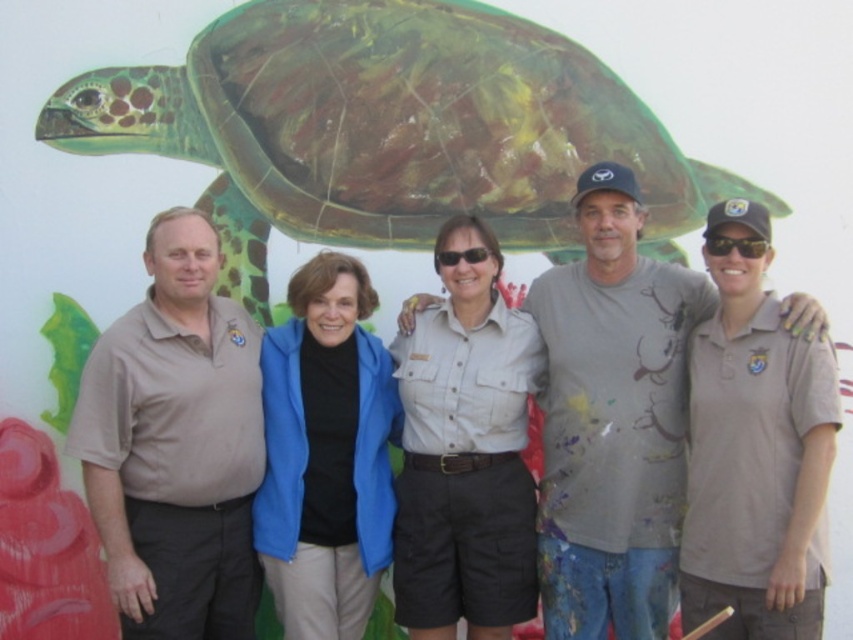
You are a photographer taking a group photo of the people in front of the mural. You need to position the two subjects wearing the brown cotton polo shirt at left and the khaki uniform at center so that they are both clearly visible in the frame. Based on their positions, which subject should be placed closer to the center of the photo to ensure both are visible?

The khaki uniform at center should be placed closer to the center of the photo since the brown cotton polo shirt at left is to the left of it, making the khaki uniform already positioned more centrally.

You are a photographer trying to capture a group photo of the five people in front of the mural. You want to ensure that the blue fleece jacket at center and the khaki uniform shirt at center are both clearly visible in the frame. Based on their widths, which clothing item should you focus on to ensure both are fully visible?

The blue fleece jacket at center has a lesser width compared to the khaki uniform shirt at center, so focusing on the khaki uniform shirt at center ensures both are fully visible since it is wider and might require more space in the frame.

Based on the photo, you are a photographer trying to capture the group in front of the mural. You need to ensure that both the blue fleece jacket at center and the khaki uniform shirt at center are visible in the frame. Based on their positions, which one should you position closer to the left side of your camera viewfinder to include both?

To include both the blue fleece jacket at center and the khaki uniform shirt at center in the frame, you should position the blue fleece jacket at center closer to the left side of the camera viewfinder since it is already to the left of the khaki uniform shirt at center.